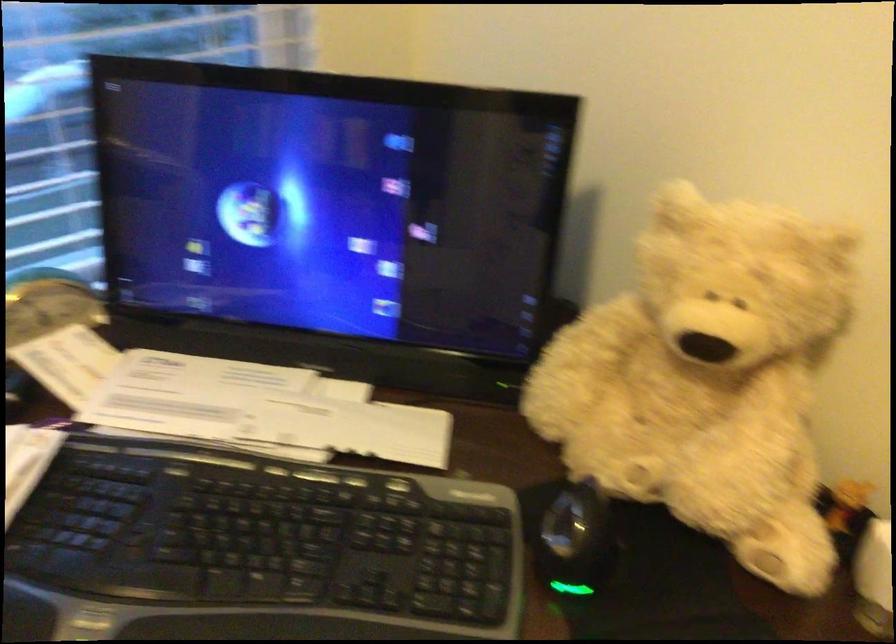
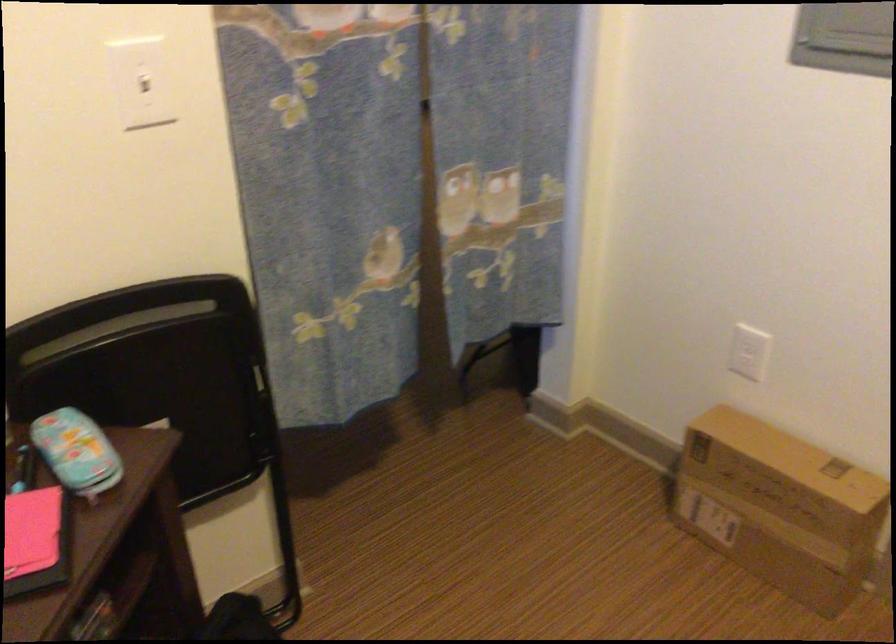
Based on the continuous images, in which direction is the camera rotating?

The camera rotated toward right-down.